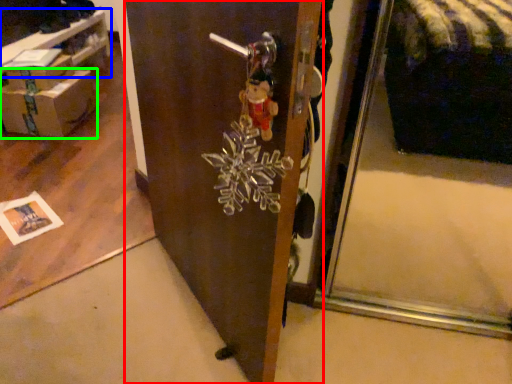
Question: Considering the real-world distances, which object is farthest from door (highlighted by a red box)? table (highlighted by a blue box) or box (highlighted by a green box)?

Choices:
 (A) table
 (B) box

Answer: (A)